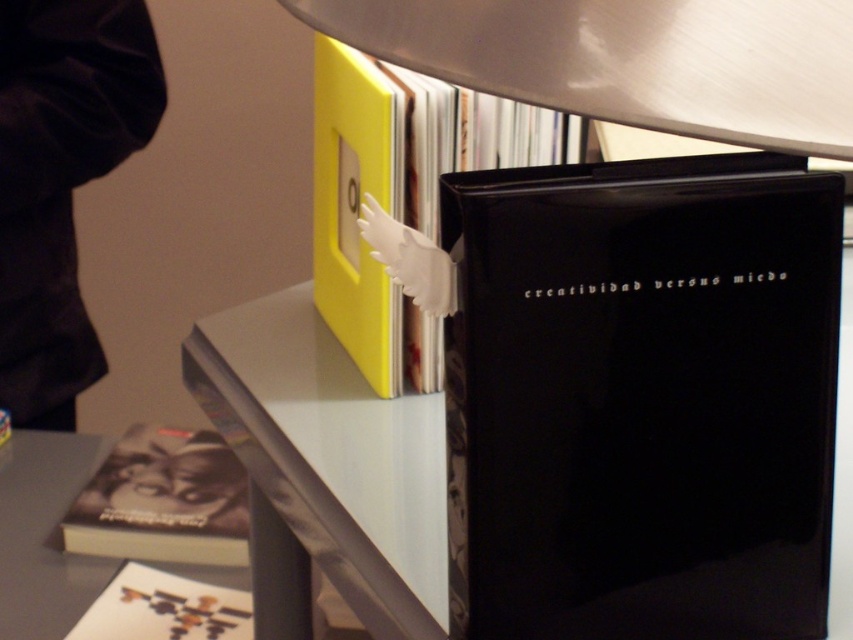
Which is behind, point (15, 365) or point (109, 493)?

The point (15, 365) is behind.

Is black velvet jacket at upper left below black matte book at lower left?

No.

The height and width of the screenshot is (640, 853). I want to click on black velvet jacket at upper left, so click(61, 180).

Find the location of a particular element. yellow matte book at upper center is located at coordinates (402, 193).

Between yellow matte book at upper center and black matte book at lower left, which one has more height?

Standing taller between the two is yellow matte book at upper center.

Is point (363, 99) closer to camera compared to point (105, 484)?

That is True.

Where is `yellow matte book at upper center`? This screenshot has width=853, height=640. yellow matte book at upper center is located at coordinates (402, 193).

Is black glossy book at center positioned at the back of matte black book at lower left?

No, it is in front of matte black book at lower left.

Does point (480, 614) come in front of point (212, 612)?

Yes, it is.

You are a GUI agent. You are given a task and a screenshot of the screen. Output one action in this format:
    pyautogui.click(x=<x>, y=<y>)
    Task: Click on the black glossy book at center
    
    Given the screenshot: What is the action you would take?
    pyautogui.click(x=641, y=397)